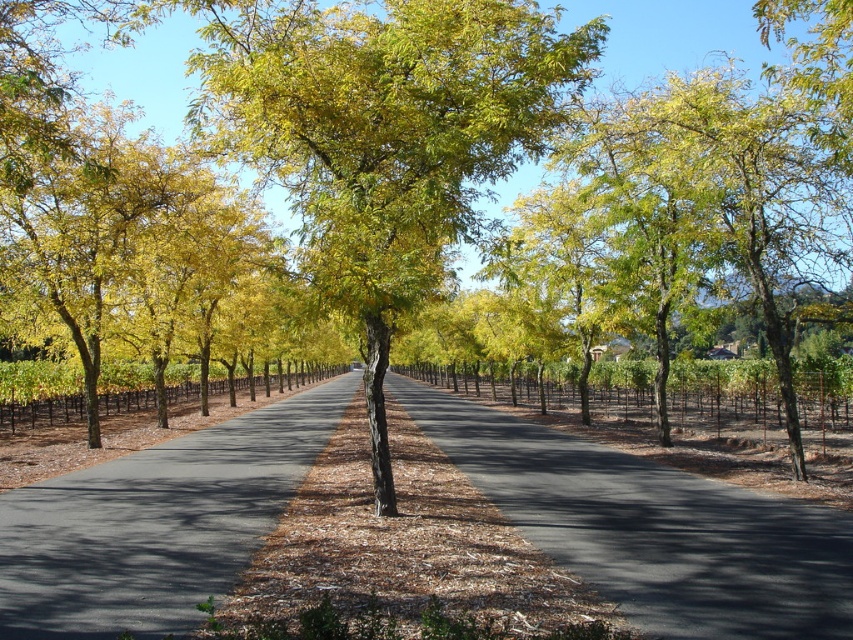
You are standing at the starting point of the road and see the point marked at coordinates (384, 136). What object is located at that point?

The point marked at coordinates (384, 136) is where the green leafy tree at center is located.

You are a cyclist planning to ride along the road in the image. You notice two types of roads at the center. Which one is wider and more suitable for cycling? Please choose between the brown dirt road at center and the brown asphalt road at center.

The brown dirt road at center is wider than the brown asphalt road at center, making it more suitable for cycling.